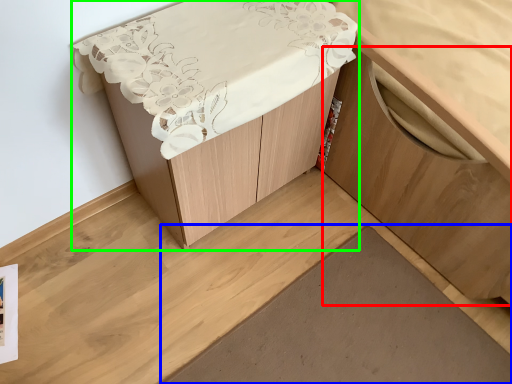
Question: Considering the real-world distances, which object is closest to cabinetry (highlighted by a red box)? plank (highlighted by a blue box) or furniture (highlighted by a green box).

Choices:
 (A) plank
 (B) furniture

Answer: (A)